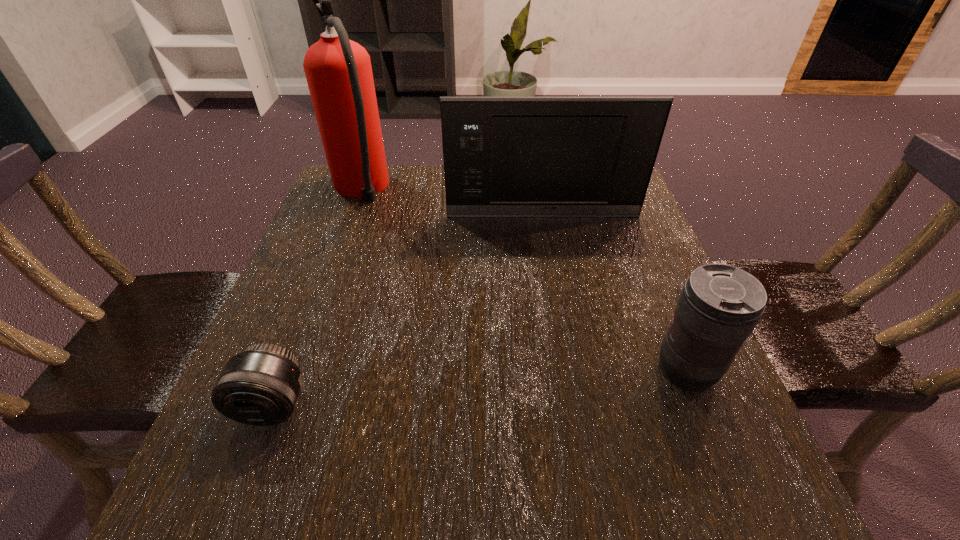
The image size is (960, 540). Identify the location of the tallest object. (338, 71).

I want to click on microwave oven, so click(503, 156).

This screenshot has height=540, width=960. What are the coordinates of `the right telephoto lens` in the screenshot? It's located at (719, 306).

This screenshot has height=540, width=960. What are the coordinates of `the second shortest object` in the screenshot? It's located at (719, 306).

You are a GUI agent. You are given a task and a screenshot of the screen. Output one action in this format:
    pyautogui.click(x=<x>, y=<y>)
    Task: Click on the shortest object
    This screenshot has height=540, width=960.
    Given the screenshot: What is the action you would take?
    pyautogui.click(x=260, y=386)

Where is `the left telephoto lens`? the left telephoto lens is located at coordinates (260, 386).

Identify the location of free space located 0.100m on the front panel of the microwave oven. (548, 244).

I want to click on free space located 0.300m on the side of the right telephoto lens where the control switches are located, so click(x=475, y=370).

The width and height of the screenshot is (960, 540). I want to click on blank space located 0.110m on the side of the right telephoto lens where the control switches are located, so click(x=588, y=370).

I want to click on free space located 0.210m on the side of the right telephoto lens where the control switches are located, so click(x=529, y=370).